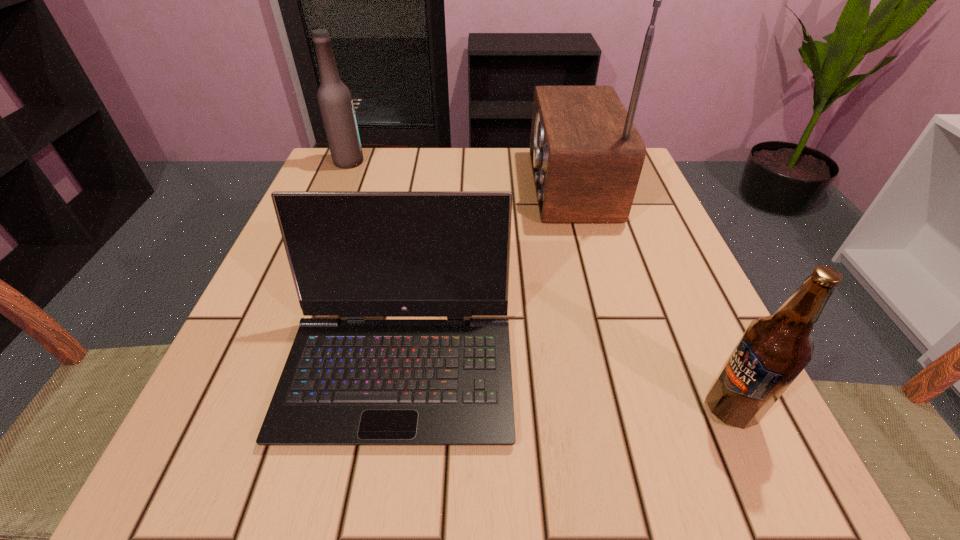
You are a GUI agent. You are given a task and a screenshot of the screen. Output one action in this format:
    pyautogui.click(x=<x>, y=<y>)
    Task: Click on the closest object to the nearer beer bottle
    This screenshot has width=960, height=540.
    Given the screenshot: What is the action you would take?
    pyautogui.click(x=346, y=382)